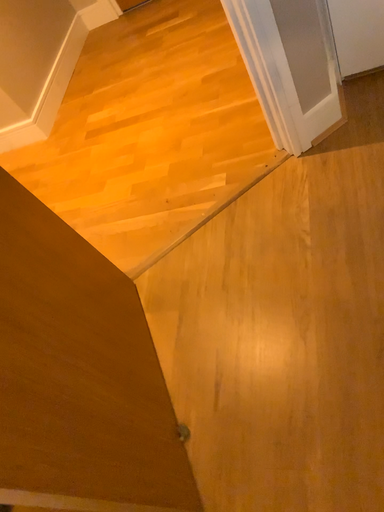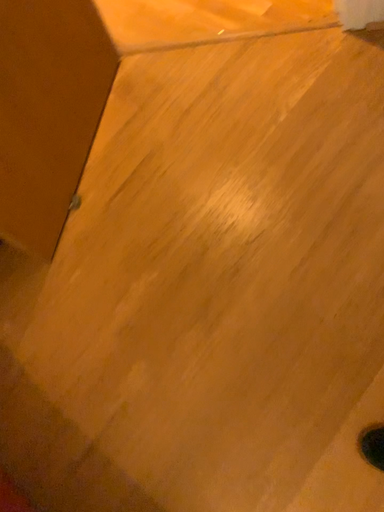
Question: Which way did the camera rotate in the video?

Choices:
 (A) rotated left
 (B) rotated right

Answer: (A)